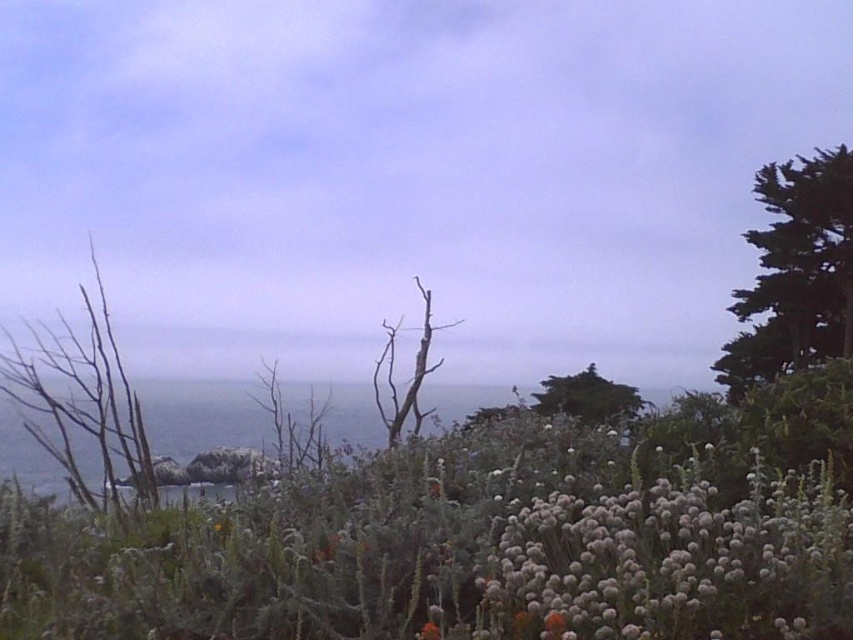
You are a hiker carrying a 6 feet long ladder. You need to place it between the green leafy tree at center and the bare wood tree at center. Can the ladder fit horizontally between them without bending?

The distance between the green leafy tree at center and the bare wood tree at center is 6.70 feet. Since the ladder is 6 feet long, it can fit horizontally between them without bending.

You are standing at the edge of the coastal landscape and want to take a photo of the green leafy tree at center. If your camera has a maximum zoom range of 20 feet, will you need to move closer to the tree to capture it clearly?

The green leafy tree at center is 29.80 feet away from the viewer. Since the camera can only zoom up to 20 feet, you will need to move closer to the tree to capture it clearly.